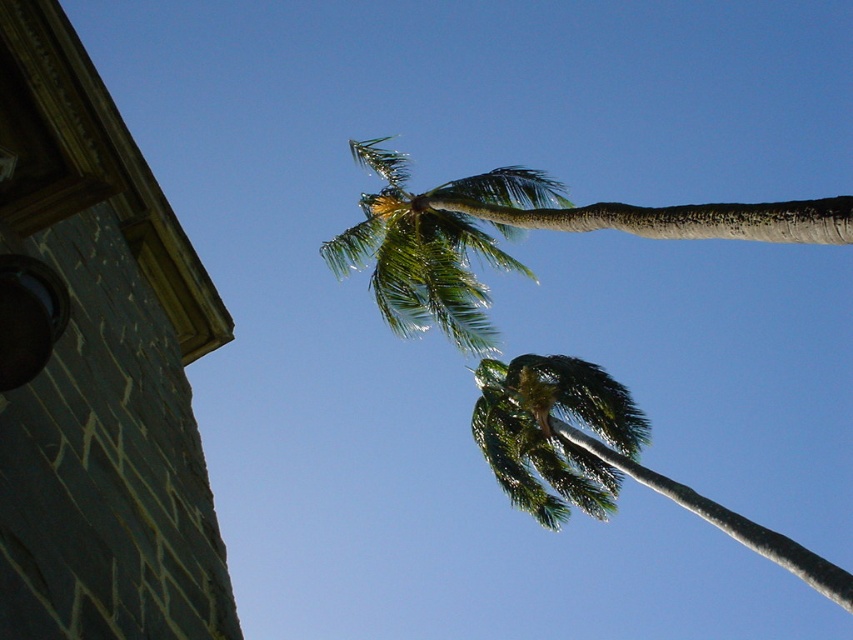
You are standing below the palm trees and want to take a photo of the green leafy palm tree at upper center without the green leafy palm at upper center blocking the view. Which one should you focus on first?

The green leafy palm tree at upper center is closer to the viewer than the green leafy palm at upper center, so you should focus on the green leafy palm tree at upper center first to avoid the other palm blocking it.